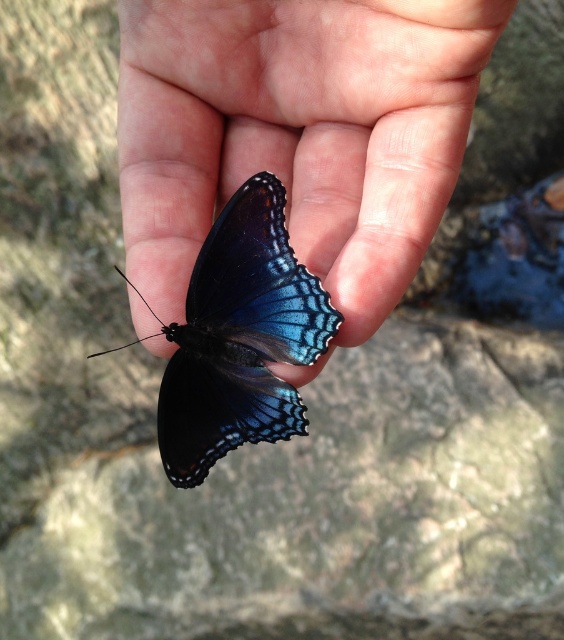
This screenshot has height=640, width=564. What do you see at coordinates (297, 132) in the screenshot?
I see `matte black butterfly at center` at bounding box center [297, 132].

This screenshot has width=564, height=640. What do you see at coordinates (297, 132) in the screenshot? I see `matte black butterfly at center` at bounding box center [297, 132].

This screenshot has height=640, width=564. Identify the location of matte black butterfly at center. (297, 132).